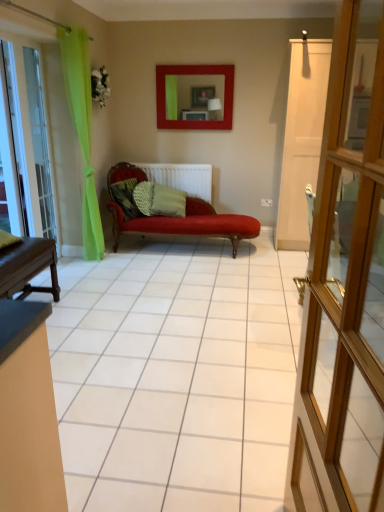
The height and width of the screenshot is (512, 384). I want to click on vacant region above matte red picture frame at upper center (from a real-world perspective), so click(x=201, y=60).